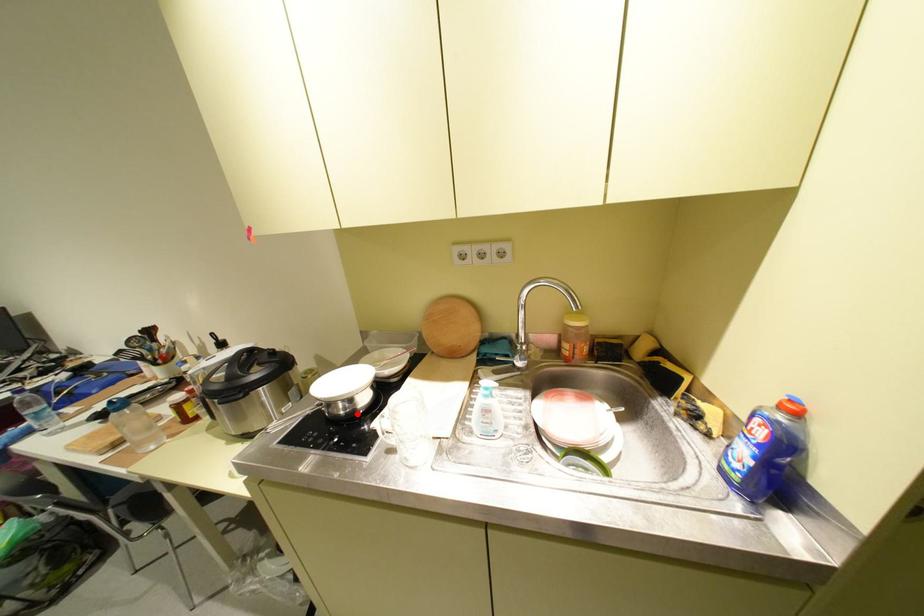
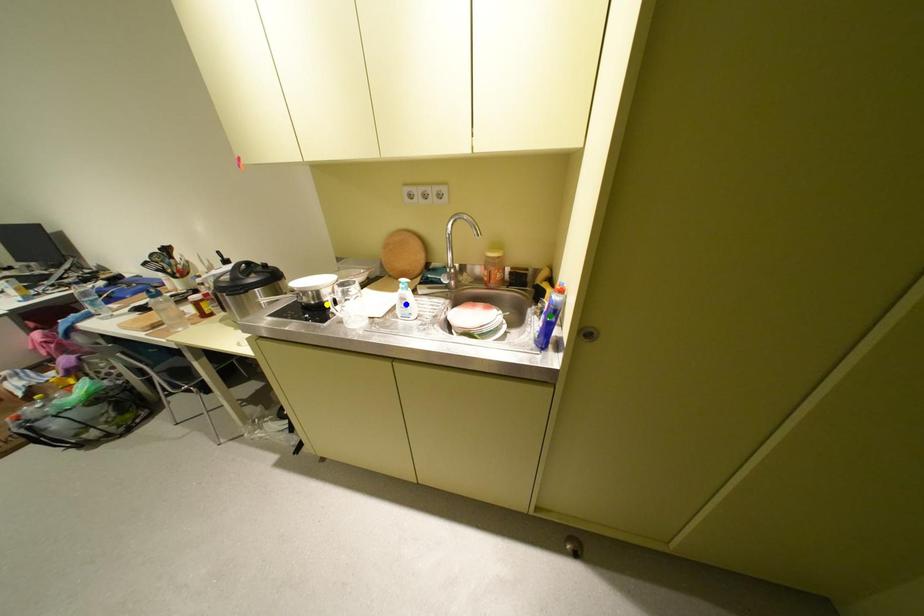
Question: I am providing you with two images of the same scene from different viewpoints. A red point is marked on the first image. You are given multiple points on the second image. Which mark in image 2 goes with the point in image 1?

Choices:
 (A) blue point
 (B) yellow point
 (C) green point

Answer: (B)